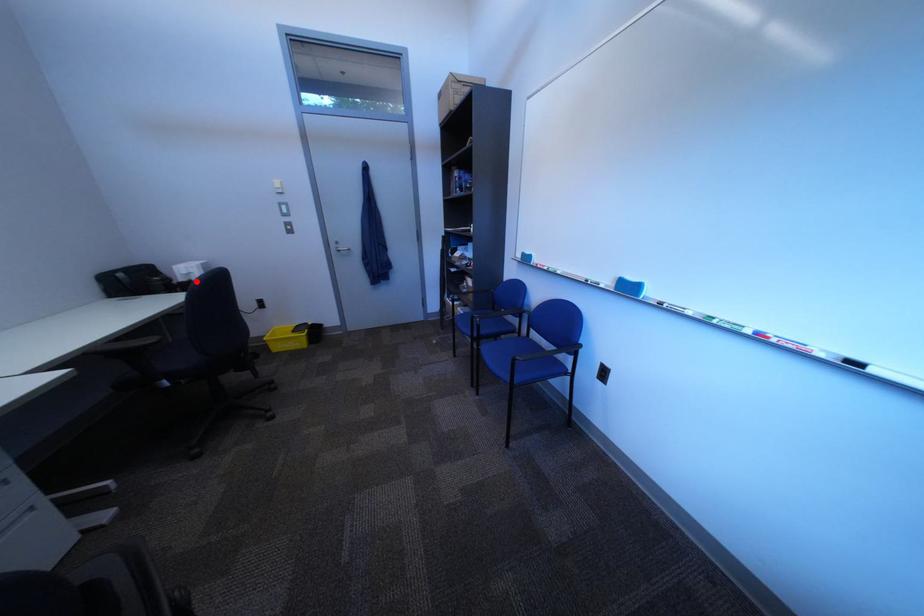
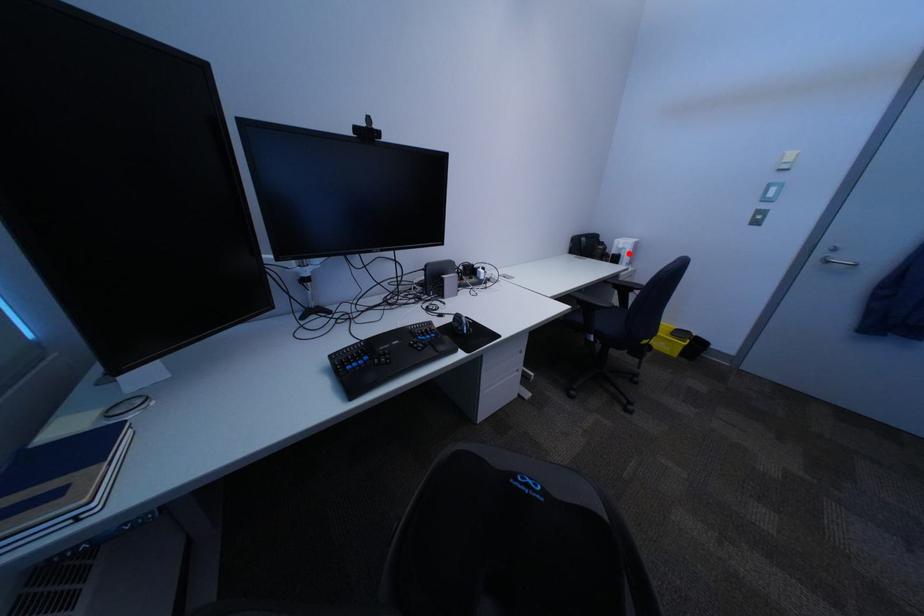
I am providing you with two images of the same scene from different viewpoints. A red point is marked on the first image and another point is marked on the second image. Is the marked point in image1 the same physical position as the marked point in image2?

Yes